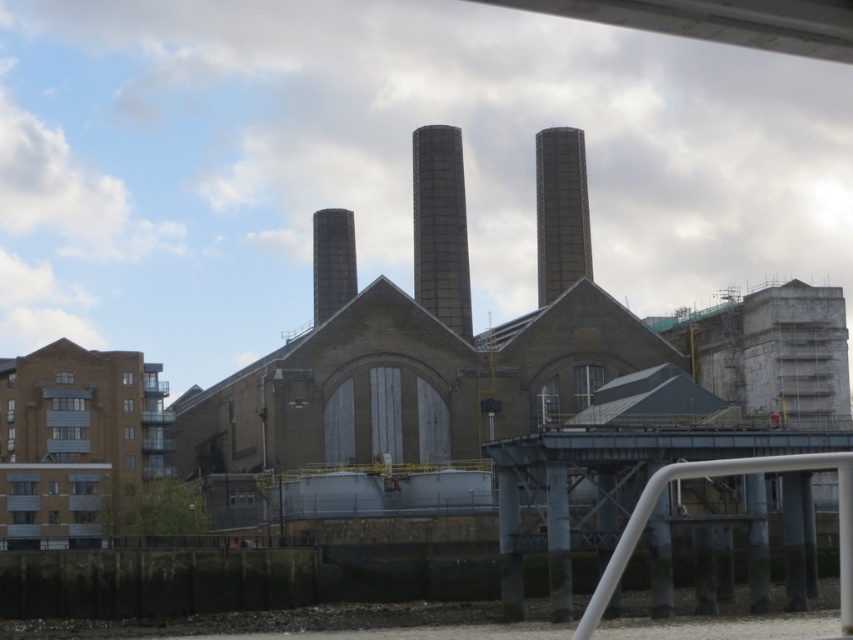
Does white metallic rail at lower right appear under smooth gray chimney at center?

Correct, white metallic rail at lower right is located below smooth gray chimney at center.

Between white metallic rail at lower right and smooth gray chimney at center, which one is positioned lower?

white metallic rail at lower right is lower down.

Between point (619, 550) and point (343, 285), which one is positioned in front?

Point (619, 550)

I want to click on white metallic rail at lower right, so click(x=721, y=476).

Can you confirm if dark gray concrete chimney at center is positioned above white metallic rail at lower right?

Yes.

Is dark gray concrete chimney at center thinner than white metallic rail at lower right?

Yes.

Is point (451, 157) in front of point (776, 470)?

That is False.

The image size is (853, 640). Identify the location of dark gray concrete chimney at center. (440, 227).

Is white metallic rail at lower right wider than dark gray textured chimney at center?

Correct, the width of white metallic rail at lower right exceeds that of dark gray textured chimney at center.

Can you confirm if white metallic rail at lower right is thinner than dark gray textured chimney at center?

In fact, white metallic rail at lower right might be wider than dark gray textured chimney at center.

Between point (583, 632) and point (573, 225), which one is positioned in front?

Point (583, 632) is more forward.

I want to click on white metallic rail at lower right, so click(721, 476).